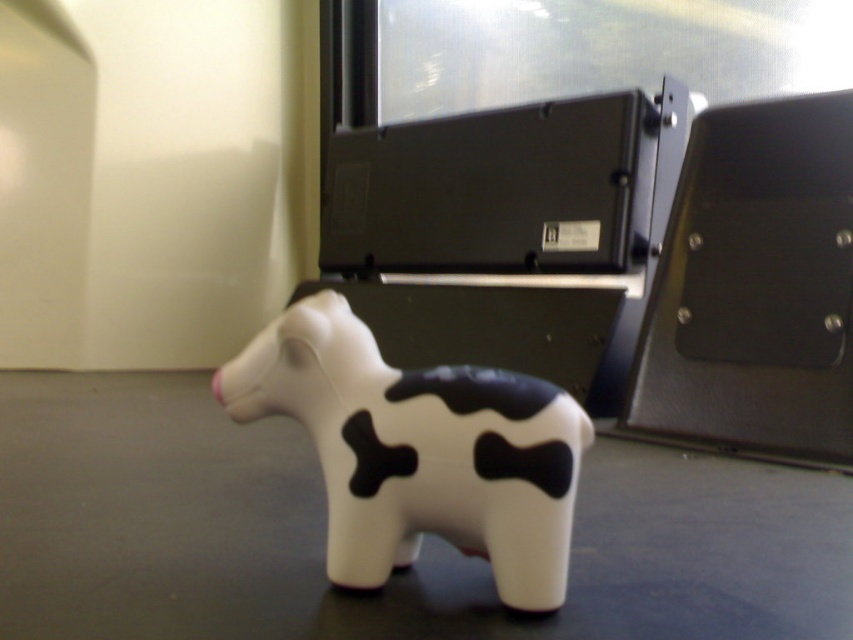
Question: Which object appears farthest from the camera in this image?

Choices:
 (A) metallic silver dot at center right
 (B) metallic silver dot at center-right
 (C) metallic dot at center right

Answer: (C)

Question: Which object appears farthest from the camera in this image?

Choices:
 (A) metallic silver dot at center right
 (B) white matte cow at lower center

Answer: (A)

Question: Which object appears closest to the camera in this image?

Choices:
 (A) white matte cow at lower center
 (B) metallic silver dot at center right
 (C) metallic silver dot at center-right

Answer: (A)

Question: Can you confirm if white matte cow at lower center is wider than metallic silver dot at center right?

Choices:
 (A) no
 (B) yes

Answer: (B)

Question: Can you confirm if metallic silver dot at center right is bigger than metallic dot at center right?

Choices:
 (A) yes
 (B) no

Answer: (A)

Question: Considering the relative positions of metallic silver dot at center right and metallic dot at center right in the image provided, where is metallic silver dot at center right located with respect to metallic dot at center right?

Choices:
 (A) above
 (B) below

Answer: (B)